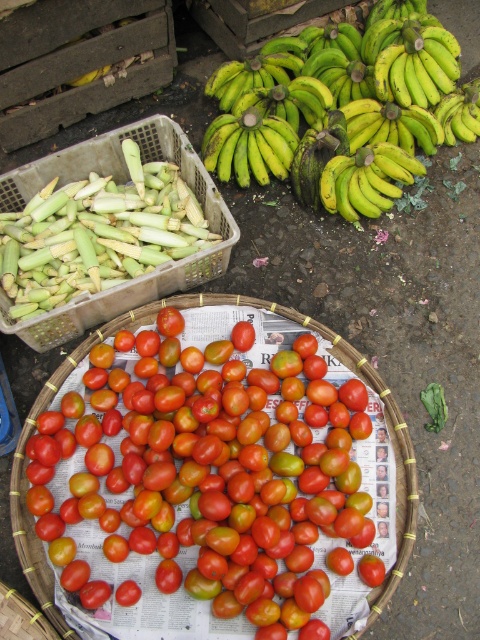
Question: Considering the real-world distances, which object is farthest from the green matte bananas at center?

Choices:
 (A) green plastic basket at upper left
 (B) yellow-green smooth bananas at center
 (C) shiny red tomatoes at center

Answer: (C)

Question: Which point is closer to the camera?

Choices:
 (A) (230, 163)
 (B) (430, 154)
 (C) (50, 320)

Answer: (C)

Question: Which of the following is the farthest from the observer?

Choices:
 (A) green plastic basket at upper left
 (B) green matte bananas at center
 (C) green matte bananas at upper center

Answer: (B)

Question: Is green matte bananas at upper center bigger than yellow-green smooth bananas at center?

Choices:
 (A) yes
 (B) no

Answer: (A)

Question: Is shiny red tomatoes at center to the left of green plastic basket at upper left from the viewer's perspective?

Choices:
 (A) yes
 (B) no

Answer: (B)

Question: Can you confirm if shiny red tomatoes at center is positioned above green matte bananas at center?

Choices:
 (A) no
 (B) yes

Answer: (A)